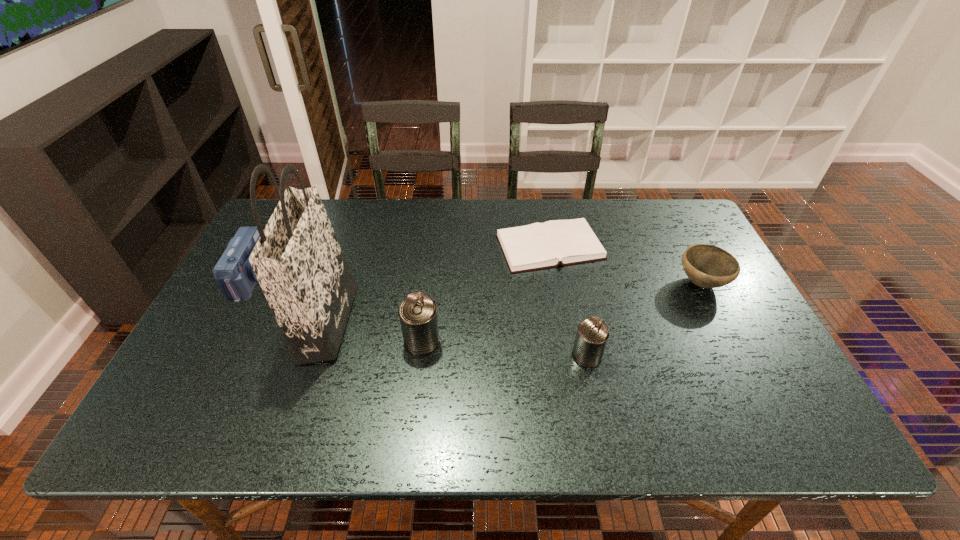
Where is `the left can`? the left can is located at coordinates pos(418,312).

Locate an element on the screen. The width and height of the screenshot is (960, 540). the third object from left to right is located at coordinates (418, 312).

Image resolution: width=960 pixels, height=540 pixels. I want to click on the right can, so pyautogui.click(x=592, y=334).

Locate an element on the screen. the leftmost object is located at coordinates pyautogui.click(x=233, y=272).

Find the location of a particular element. hardback book is located at coordinates (536, 246).

At what (x,y) coordinates should I click in order to perform the action: click on the fifth tallest object. Please return your answer as a coordinate pair (x, y). The image size is (960, 540). Looking at the image, I should click on (708, 266).

At what (x,y) coordinates should I click in order to perform the action: click on bowl. Please return your answer as a coordinate pair (x, y). Looking at the image, I should click on (708, 266).

You are a GUI agent. You are given a task and a screenshot of the screen. Output one action in this format:
    pyautogui.click(x=<x>, y=<y>)
    Task: Click on the shopping bag
    
    Given the screenshot: What is the action you would take?
    pyautogui.click(x=298, y=262)

Identify the location of the tallest object. The width and height of the screenshot is (960, 540). (298, 262).

The width and height of the screenshot is (960, 540). What are the coordinates of `vacant space located on the right of the taller can` in the screenshot? It's located at (472, 341).